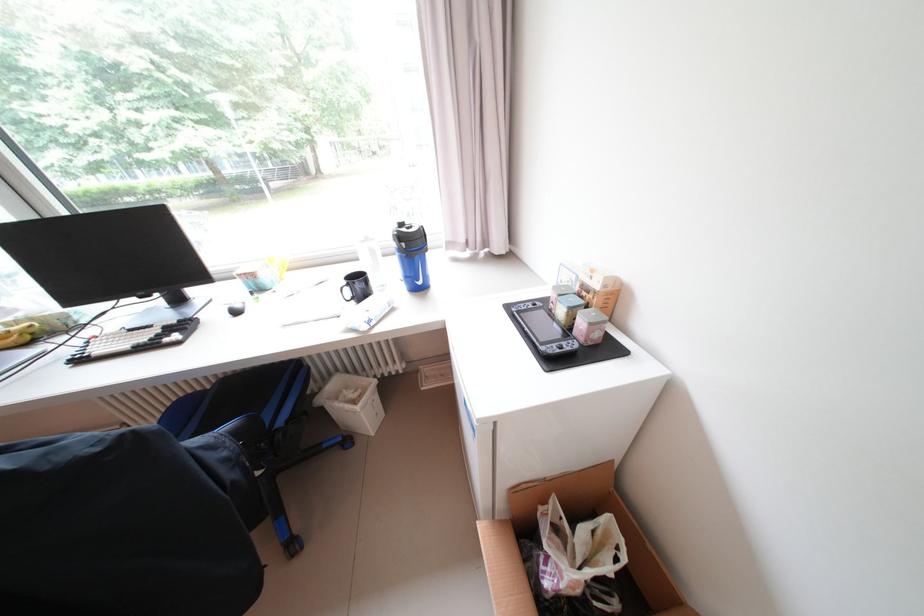
I want to click on blue chair armrest, so click(290, 415).